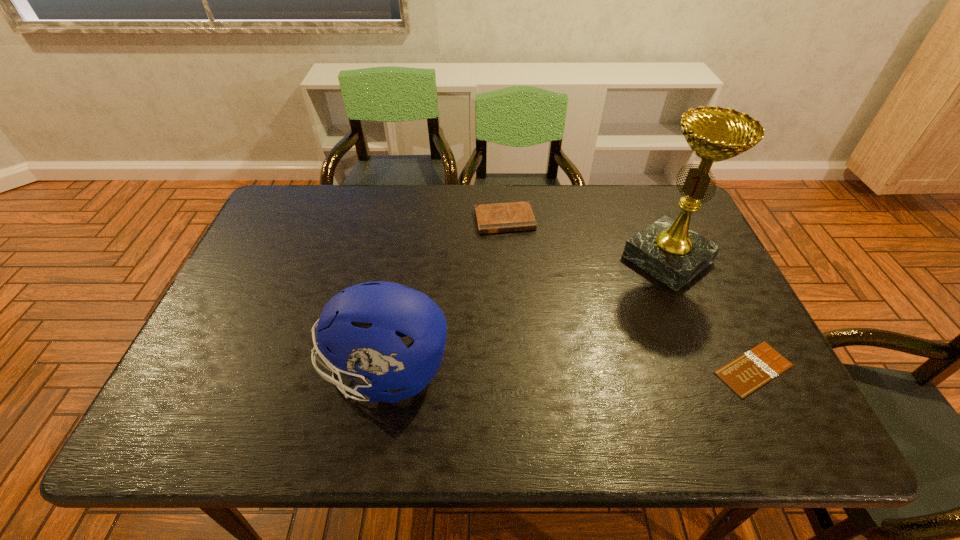
I want to click on the second tallest object, so pos(357,331).

Where is `football helmet`? The image size is (960, 540). football helmet is located at coordinates (357, 331).

In order to click on the shortest object in this screenshot , I will do `click(748, 372)`.

Locate an element on the screen. the tallest object is located at coordinates (667, 249).

Identify the location of diary. (516, 216).

Find the location of a particular element. The height and width of the screenshot is (540, 960). the third object from right to left is located at coordinates (516, 216).

Find the location of a particular element. Image resolution: width=960 pixels, height=540 pixels. vacant region located 0.210m on the front-facing side of the leftmost object is located at coordinates (228, 372).

In order to click on free location located 0.300m on the front-facing side of the leftmost object in this screenshot , I will do `click(188, 372)`.

You are a GUI agent. You are given a task and a screenshot of the screen. Output one action in this format:
    pyautogui.click(x=<x>, y=<y>)
    Task: Click on the free space located 0.180m on the front-facing side of the leftmost object
    This screenshot has height=540, width=960.
    Given the screenshot: What is the action you would take?
    pyautogui.click(x=241, y=372)

Locate an element on the screen. vacant space located 0.050m on the back of the shortest object is located at coordinates (732, 325).